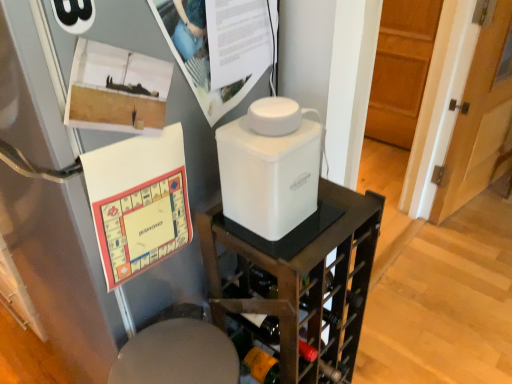
Image resolution: width=512 pixels, height=384 pixels. Describe the element at coordinates (302, 282) in the screenshot. I see `white plastic container at center` at that location.

Where is `white plastic container at center`? This screenshot has width=512, height=384. white plastic container at center is located at coordinates (270, 167).

What do you see at coordinates (209, 60) in the screenshot? I see `matte paper poster at upper center` at bounding box center [209, 60].

Where is `white plastic container at center`? The image size is (512, 384). white plastic container at center is located at coordinates (302, 282).

Looking at this image, measure the distance from white plastic container at center to white plastic container at center.

7.79 inches.

Based on the photo, from a real-world perspective, is white plastic container at center physically below white plastic container at center?

Indeed, from a real-world perspective, white plastic container at center is positioned beneath white plastic container at center.

Between white plastic container at center and white plastic container at center, which one has more height?

Standing taller between the two is white plastic container at center.

Find the location of a particular element. Image resolution: width=512 pixels, height=384 pixels. appliance above the white plastic container at center (from the image's perspective) is located at coordinates (270, 167).

Is white plastic container at center far away from matte paper poster at upper center?

No, white plastic container at center is in close proximity to matte paper poster at upper center.

Is white plastic container at center facing away from matte paper poster at upper center?

No, white plastic container at center is not facing away from matte paper poster at upper center.

Considering the sizes of objects white plastic container at center and matte paper poster at upper center in the image provided, who is shorter, white plastic container at center or matte paper poster at upper center?

matte paper poster at upper center is shorter.

Considering the points (417, 113) and (296, 218), which point is in front, point (417, 113) or point (296, 218)?

The point (296, 218) is closer.

Considering the relative positions of wooden door at right and white plastic container at center in the image provided, is wooden door at right in front of white plastic container at center?

No, wooden door at right is further to the viewer.

Is wooden door at right thinner than white plastic container at center?

Yes, wooden door at right is thinner than white plastic container at center.

From a real-world perspective, which is physically above, wooden door at right or white plastic container at center?

In real-world perspective, white plastic container at center is above.

Is matte paper poster at upper center in contact with white plastic container at center?

No, matte paper poster at upper center is not beside white plastic container at center.

Which point is more distant from viewer, (266,51) or (246,171)?

The point (266,51) is farther.

From the image's perspective, which object appears higher, matte paper poster at upper center or white plastic container at center?

matte paper poster at upper center.

Is white plastic container at center bigger than wooden door at right?

Actually, white plastic container at center might be smaller than wooden door at right.

In the image, is white plastic container at center positioned in front of or behind wooden door at right?

In the image, white plastic container at center appears in front of wooden door at right.

Visually, is white plastic container at center positioned to the left or to the right of wooden door at right?

white plastic container at center is to the left of wooden door at right.

Looking at this image, are white plastic container at center and wooden door at right making contact?

white plastic container at center is not next to wooden door at right, and they're not touching.

Does point (154, 16) come behind point (426, 69)?

No, (154, 16) is closer to viewer.

From the image's perspective, who appears lower, matte paper poster at upper center or wooden door at right?

matte paper poster at upper center is shown below in the image.

I want to click on poster page that appears on the left of wooden door at right, so click(209, 60).

Is matte paper poster at upper center oriented away from wooden door at right?

Yes, matte paper poster at upper center is facing away from wooden door at right.

Considering the sizes of objects white plastic container at center and matte paper poster at upper center in the image provided, who is smaller, white plastic container at center or matte paper poster at upper center?

With smaller size is matte paper poster at upper center.

What's the angular difference between white plastic container at center and matte paper poster at upper center's facing directions?

91 degrees separate the facing orientations of white plastic container at center and matte paper poster at upper center.

In order to click on poster page positioned vertically above the white plastic container at center (from a real-world perspective) in this screenshot , I will do `click(209, 60)`.

Is white plastic container at center outside of matte paper poster at upper center?

Yes, white plastic container at center is located beyond the bounds of matte paper poster at upper center.

Identify the location of appliance above the white plastic container at center (from a real-world perspective). The height and width of the screenshot is (384, 512). (270, 167).

Locate an element on the screen. The height and width of the screenshot is (384, 512). furniture that appears below the matte paper poster at upper center (from a real-world perspective) is located at coordinates (302, 282).

Considering their positions, is matte paper poster at upper center positioned closer to white plastic container at center than white plastic container at center?

The object closer to white plastic container at center is white plastic container at center.

When comparing their distances from white plastic container at center, does white plastic container at center or matte paper poster at upper center seem closer?

matte paper poster at upper center is positioned closer to the anchor white plastic container at center.

Estimate the real-world distances between objects in this image. Which object is further from wooden door at right, white plastic container at center or matte paper poster at upper center?

matte paper poster at upper center is positioned further to the anchor wooden door at right.

Estimate the real-world distances between objects in this image. Which object is further from wooden door at right, white plastic container at center or white plastic container at center?

white plastic container at center.

Looking at the image, which one is located closer to matte paper poster at upper center, white plastic container at center or white plastic container at center?

The object closer to matte paper poster at upper center is white plastic container at center.

From the picture: Based on their spatial positions, is matte paper poster at upper center or wooden door at right closer to white plastic container at center?

Among the two, matte paper poster at upper center is located nearer to white plastic container at center.

Which object lies nearer to the anchor point white plastic container at center, white plastic container at center or wooden door at right?

white plastic container at center is closer to white plastic container at center.

Estimate the real-world distances between objects in this image. Which object is further from white plastic container at center, matte paper poster at upper center or white plastic container at center?

Based on the image, white plastic container at center appears to be further to white plastic container at center.

The height and width of the screenshot is (384, 512). In order to click on appliance that lies between matte paper poster at upper center and white plastic container at center from top to bottom in this screenshot , I will do `click(270, 167)`.

Image resolution: width=512 pixels, height=384 pixels. What are the coordinates of `appliance positioned between matte paper poster at upper center and wooden door at right from near to far` in the screenshot? It's located at (270, 167).

Where is `furniture between matte paper poster at upper center and wooden door at right along the z-axis`? furniture between matte paper poster at upper center and wooden door at right along the z-axis is located at coordinates (302, 282).

The image size is (512, 384). I want to click on furniture between white plastic container at center and wooden door at right in the front-back direction, so click(302, 282).